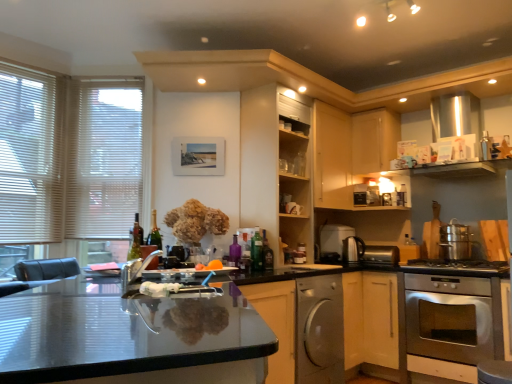
Where is `green glass bottle at center, which is the second bottle from right to left`? green glass bottle at center, which is the second bottle from right to left is located at coordinates (257, 252).

This screenshot has height=384, width=512. Find the location of `brushed metal faucet at center, which is the 1th appliance in front-to-back order`. brushed metal faucet at center, which is the 1th appliance in front-to-back order is located at coordinates (147, 250).

Find the location of a particular element. translucent glass bottle at center, which is the 4th bottle from right to left is located at coordinates (154, 233).

In order to face stainless steel gas stove at right, should I rotate leftwards or rightwards?

Turn right by 25.249 degrees to look at stainless steel gas stove at right.

Identify the location of stainless steel gas stove at right. (459, 265).

Where is `satin silver dishwasher at lower center`? Image resolution: width=512 pixels, height=384 pixels. satin silver dishwasher at lower center is located at coordinates (319, 330).

Find the location of `green glass wine bottle at left`. green glass wine bottle at left is located at coordinates (136, 240).

In the scene shown: Is glossy glass countertop at center placed right next to wooden shelves at center, the 3th cabinetry from the right?

No, glossy glass countertop at center is not making contact with wooden shelves at center, the 3th cabinetry from the right.

Does point (76, 346) come behind point (292, 212)?

No, it is not.

You are a GUI agent. You are given a task and a screenshot of the screen. Output one action in this format:
    pyautogui.click(x=<x>, y=<y>)
    Task: Click on the 1st cabinetry to the right of the glossy glass countertop at center, starting your count from the anchor
    The image size is (512, 384).
    Given the screenshot: What is the action you would take?
    pyautogui.click(x=276, y=167)

Do you think white plastic blinds at left is within satin silver toaster at lower center, which is the fourth appliance in front-to-back order, or outside of it?

white plastic blinds at left lies outside satin silver toaster at lower center, which is the fourth appliance in front-to-back order.

From the image's perspective, is white plastic blinds at left positioned above or below satin silver toaster at lower center, arranged as the third appliance when viewed from the right?

From the image's perspective, white plastic blinds at left appears above satin silver toaster at lower center, arranged as the third appliance when viewed from the right.

Is white plastic blinds at left taller than satin silver toaster at lower center, placed as the 2th appliance when sorted from left to right?

Yes.

Considering the relative sizes of white plastic blinds at left and satin silver toaster at lower center, positioned as the 1th appliance in back-to-front order, in the image provided, is white plastic blinds at left thinner than satin silver toaster at lower center, positioned as the 1th appliance in back-to-front order,?

Yes.

Image resolution: width=512 pixels, height=384 pixels. Identify the location of gas stove located behind the orange matte fruit at center. (459, 265).

From a real-world perspective, between orange matte fruit at center and stainless steel gas stove at right, who is vertically higher?

From a 3D spatial view, orange matte fruit at center is above.

Looking at the image, does orange matte fruit at center seem bigger or smaller compared to stainless steel gas stove at right?

orange matte fruit at center is smaller than stainless steel gas stove at right.

Which bottle is the 2nd one when counting from the right side of the purple glass bottle at center, the 3th bottle in the right-to-left sequence? Please provide its 2D coordinates.

[(267, 256)]

Does translucent glass bottle at center, which is counted as the 4th bottle, starting from the left, turn towards purple glass bottle at center, the 3th bottle in the right-to-left sequence?

No, translucent glass bottle at center, which is counted as the 4th bottle, starting from the left, does not turn towards purple glass bottle at center, the 3th bottle in the right-to-left sequence.

How much distance is there between translucent glass bottle at center, the 1th bottle when ordered from right to left, and purple glass bottle at center, arranged as the 2th bottle when viewed from the left?

translucent glass bottle at center, the 1th bottle when ordered from right to left, is 8.07 inches away from purple glass bottle at center, arranged as the 2th bottle when viewed from the left.

Consider the image. Between translucent glass bottle at center, which is counted as the 4th bottle, starting from the left, and purple glass bottle at center, arranged as the 2th bottle when viewed from the left, which one has smaller width?

With smaller width is purple glass bottle at center, arranged as the 2th bottle when viewed from the left.

Is light wood cabinet at upper center, acting as the 2th cabinetry starting from the left, next to stainless steel oven at lower right?

light wood cabinet at upper center, acting as the 2th cabinetry starting from the left, and stainless steel oven at lower right are clearly separated.

Who is more distant, light wood cabinet at upper center, acting as the 2th cabinetry starting from the left, or stainless steel oven at lower right?

light wood cabinet at upper center, acting as the 2th cabinetry starting from the left, is behind.

How many degrees apart are the facing directions of light wood cabinet at upper center, acting as the 2th cabinetry starting from the left, and stainless steel oven at lower right?

The facing directions of light wood cabinet at upper center, acting as the 2th cabinetry starting from the left, and stainless steel oven at lower right are 90.6 degrees apart.

Is light wood cabinet at upper center, arranged as the 2th cabinetry when viewed from the right, looking in the opposite direction of stainless steel oven at lower right?

light wood cabinet at upper center, arranged as the 2th cabinetry when viewed from the right, does not have its back to stainless steel oven at lower right.

From the picture: From the image's perspective, relative to orange matte fruit at center, is glossy glass countertop at center above or below?

From the image's perspective, glossy glass countertop at center appears below orange matte fruit at center.

Can you tell me how much glossy glass countertop at center and orange matte fruit at center differ in facing direction?

The angle between the facing direction of glossy glass countertop at center and the facing direction of orange matte fruit at center is 74.3 degrees.

Is glossy glass countertop at center to the left or to the right of orange matte fruit at center in the image?

glossy glass countertop at center is positioned on orange matte fruit at center's left side.

Does white plastic blinds at left have a smaller size compared to green glass wine bottle at left?

No.

Looking at this image, is white plastic blinds at left outside of green glass wine bottle at left?

Yes, white plastic blinds at left is located beyond the bounds of green glass wine bottle at left.

Could you tell me if white plastic blinds at left is facing green glass wine bottle at left?

Yes, white plastic blinds at left is facing green glass wine bottle at left.

Which is behind, point (143, 83) or point (137, 225)?

Point (143, 83)

Identify the location of countertop located below the wooden shelves at center, the 3th cabinetry from the right (from the image's perspective). The height and width of the screenshot is (384, 512). (132, 339).

Where is `blind on the left of satin silver toaster at lower center, arranged as the third appliance when viewed from the right`? This screenshot has height=384, width=512. blind on the left of satin silver toaster at lower center, arranged as the third appliance when viewed from the right is located at coordinates (104, 157).

Estimate the real-world distances between objects in this image. Which object is closer to satin silver dishwasher at lower center, purple glass bottle at center, the 3th bottle in the right-to-left sequence, or satin silver toaster at lower center, arranged as the third appliance when viewed from the right?

Based on the image, purple glass bottle at center, the 3th bottle in the right-to-left sequence, appears to be nearer to satin silver dishwasher at lower center.

From the picture: Based on their spatial positions, is green glass bottle at center, marked as the third bottle in a left-to-right arrangement, or white plastic blinds at left closer to metallic silver toaster at lower center, the third appliance in the front-to-back sequence?

green glass bottle at center, marked as the third bottle in a left-to-right arrangement, is closer to metallic silver toaster at lower center, the third appliance in the front-to-back sequence.

Looking at the image, which one is located closer to light wood cabinet at upper right, which is the 3th cabinetry in left-to-right order, light wood cabinet at upper center, arranged as the 2th cabinetry when viewed from the right, or white blinds at left?

light wood cabinet at upper center, arranged as the 2th cabinetry when viewed from the right, lies closer to light wood cabinet at upper right, which is the 3th cabinetry in left-to-right order, than the other object.

Looking at the image, which one is located closer to white blinds at left, brushed metal faucet at center, which is the 1th appliance in front-to-back order, or white plastic blinds at left?

The object closer to white blinds at left is white plastic blinds at left.

Based on their spatial positions, is light wood cabinet at upper right, the 1th cabinetry from the right, or light wood cabinet at upper center, acting as the 2th cabinetry starting from the left, further from stainless steel oven at lower right?

light wood cabinet at upper right, the 1th cabinetry from the right, lies further to stainless steel oven at lower right than the other object.

Considering their positions, is brushed metal faucet at center, which is the 1th appliance in front-to-back order, positioned closer to white plastic blinds at left than satin silver dishwasher at lower center?

The object closer to white plastic blinds at left is brushed metal faucet at center, which is the 1th appliance in front-to-back order.

Looking at the image, which one is located further to white plastic blinds at left, white blinds at left or translucent glass bottle at center, which is counted as the 4th bottle, starting from the left?

translucent glass bottle at center, which is counted as the 4th bottle, starting from the left, is positioned further to the anchor white plastic blinds at left.

Considering their positions, is metallic silver toaster at lower center, the 4th appliance in the left-to-right sequence, positioned further to translucent glass bottle at center, the 1th bottle when ordered from right to left, than orange matte fruit at center?

metallic silver toaster at lower center, the 4th appliance in the left-to-right sequence.

Identify the location of appliance between translucent glass bottle at center, which is the 1th bottle from left to right, and purple glass bottle at center, arranged as the 2th bottle when viewed from the left, in the horizontal direction. The width and height of the screenshot is (512, 384). (147, 250).

Identify the location of appliance positioned between glossy glass countertop at center and shiny metallic kettle at right, acting as the 2th appliance starting from the right, from near to far. The height and width of the screenshot is (384, 512). click(x=147, y=250).

Find the location of a particular element. wine bottle between white plastic blinds at left and metallic silver toaster at lower center, the third appliance in the front-to-back sequence, in the horizontal direction is located at coordinates (136, 240).

Locate an element on the screen. This screenshot has width=512, height=384. wine bottle between white plastic blinds at left and satin silver dishwasher at lower center from left to right is located at coordinates (136, 240).